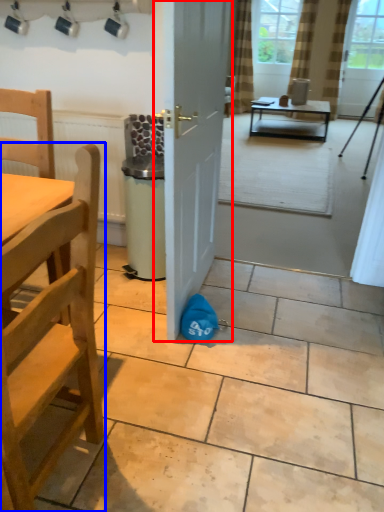
Question: Which object appears farthest to the camera in this image, door (highlighted by a red box) or chair (highlighted by a blue box)?

Choices:
 (A) door
 (B) chair

Answer: (A)